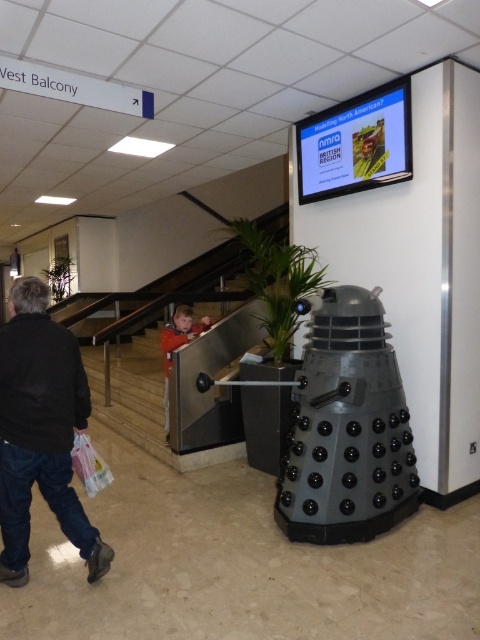
Can you confirm if black matte jacket at lower left is positioned below orange fleece jacket at lower center?

Correct, black matte jacket at lower left is located below orange fleece jacket at lower center.

Is point (51, 323) farther from viewer compared to point (201, 317)?

No, it is not.

Is point (64, 365) in front of point (173, 348)?

That is True.

Image resolution: width=480 pixels, height=640 pixels. I want to click on black matte jacket at lower left, so click(x=40, y=429).